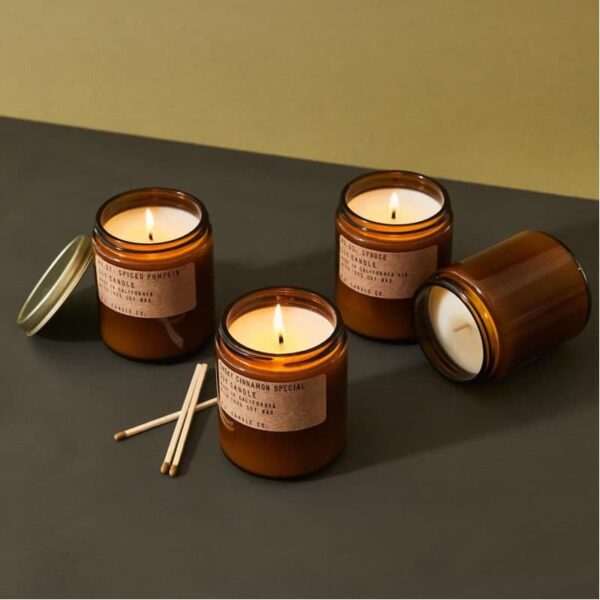
I want to click on candles, so click(288, 242), click(271, 364), click(181, 284), click(378, 286), click(489, 296), click(274, 392).